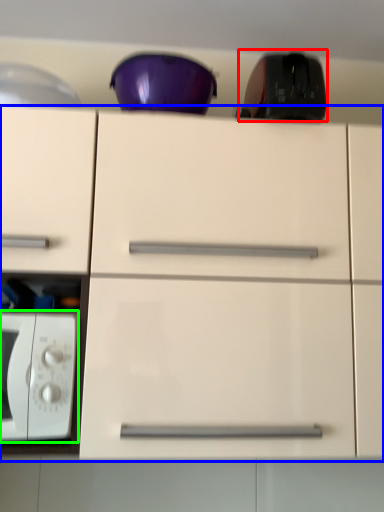
Question: Which object is the farthest from appliance (highlighted by a red box)? Choose among these: cabinetry (highlighted by a blue box) or microwave oven (highlighted by a green box).

Choices:
 (A) cabinetry
 (B) microwave oven

Answer: (B)